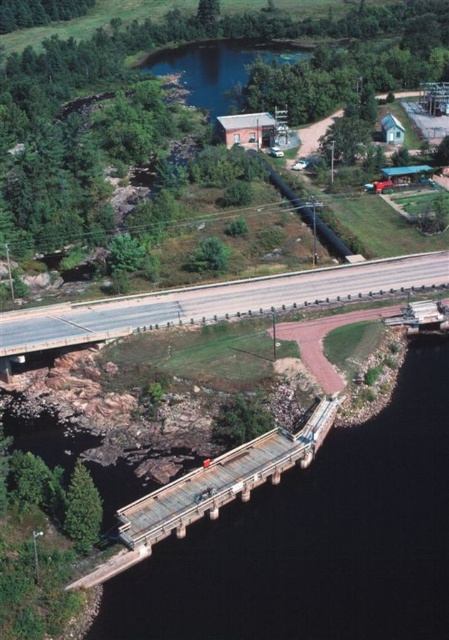
You are a drone operator trying to capture a photo of the dam structure. You need to ensure that both the asphalt road at center and the rusty metal bridge at center are visible in the frame. Which object should you position closer to the camera to include both in the shot?

The asphalt road at center is further to the viewer than the rusty metal bridge at center, so positioning the camera closer to the asphalt road at center would allow both objects to be in the frame.

Based on the photo, you are driving a truck that is 3 meters wide. You need to cross the area shown in the image. Can you safely drive on the asphalt road at center or the rusty metal bridge at center?

The asphalt road at center is wider than the rusty metal bridge at center. Since your truck is 3 meters wide, you can safely drive on the asphalt road at center but not the rusty metal bridge at center.

From the picture: You are a delivery truck driver who needs to cross the rusty metal bridge at center. However, your truck is too wide to safely pass through the gap between the asphalt road at center and the bridge. Based on the scene description, can you determine which direction you should turn to reach the bridge safely?

The asphalt road at center is positioned on the left side of the rusty metal bridge at center. Therefore, to safely reach the rusty metal bridge at center, you should turn to the right from the asphalt road at center since the bridge is located to the right of the road.